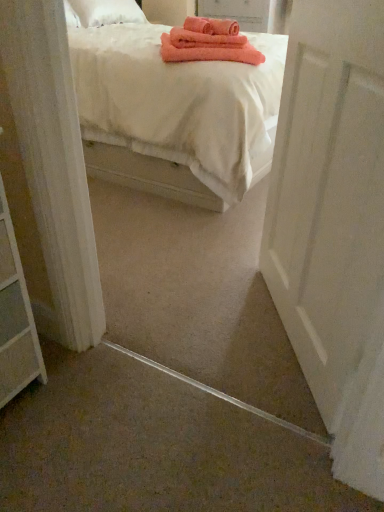
At what (x,y) coordinates should I click in order to perform the action: click on vacant space behind white matte door at right. Please return your answer as a coordinate pair (x, y). This screenshot has width=384, height=512. Looking at the image, I should click on (220, 258).